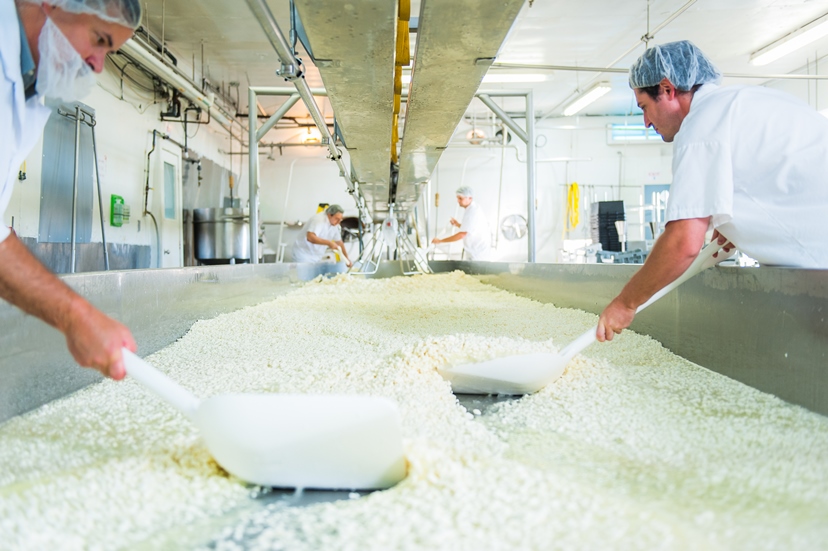
Where is `first aid kit`? This screenshot has height=551, width=828. first aid kit is located at coordinates (116, 197).